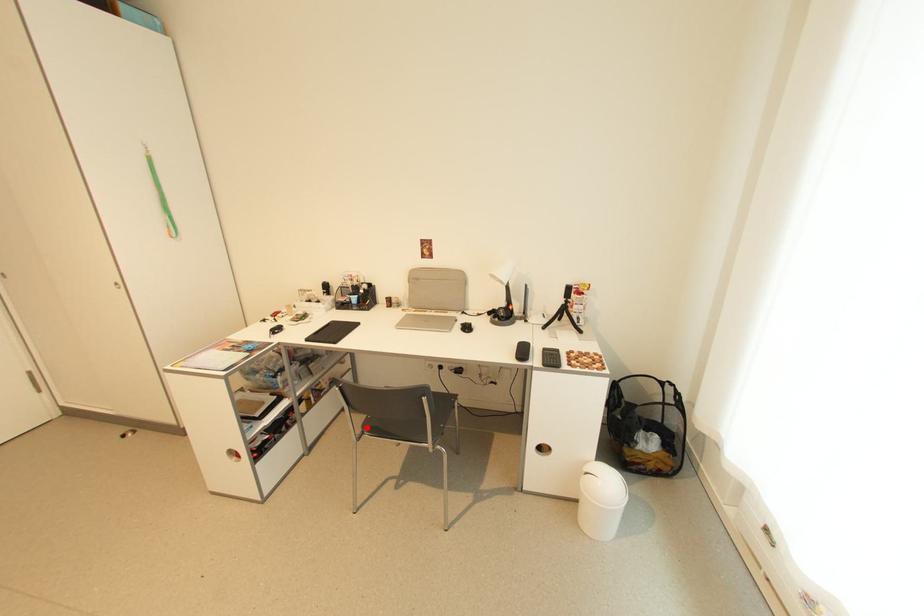
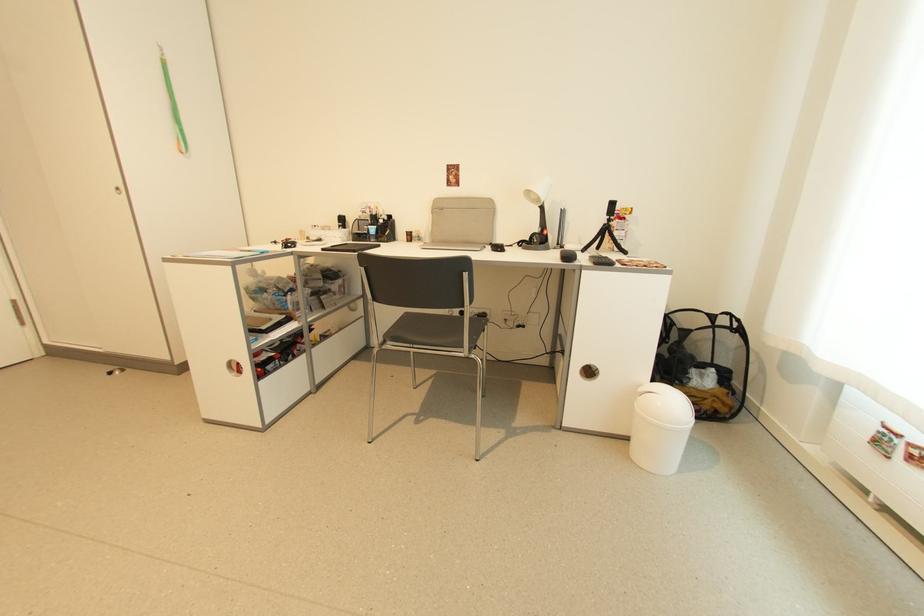
Find the pixel in the second image that matches the highlighted location in the first image.

(388, 337)